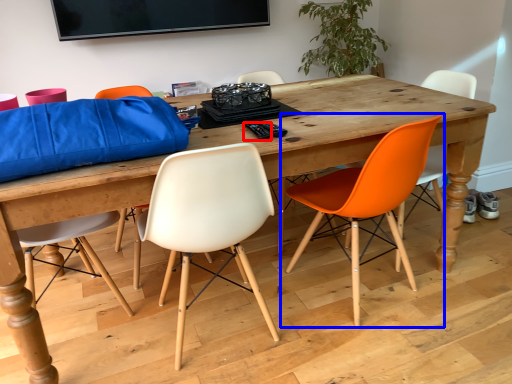
Question: Which object is further to the camera taking this photo, remote control (highlighted by a red box) or chair (highlighted by a blue box)?

Choices:
 (A) remote control
 (B) chair

Answer: (A)